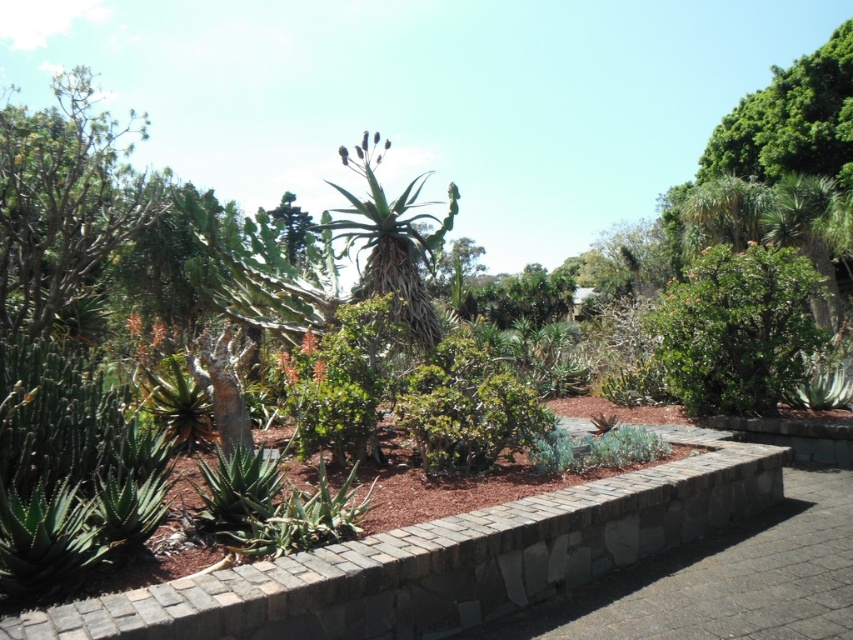
Does point (849, 486) lie in front of point (703, 332)?

Yes, point (849, 486) is closer to viewer.

Based on the photo, can you confirm if gray stone bench at lower center is positioned to the right of green leafy bush at center-right?

In fact, gray stone bench at lower center is to the left of green leafy bush at center-right.

The height and width of the screenshot is (640, 853). Describe the element at coordinates (721, 579) in the screenshot. I see `gray stone bench at lower center` at that location.

Find the location of a particular element. gray stone bench at lower center is located at coordinates (721, 579).

Is point (741, 614) closer to viewer compared to point (88, 170)?

Yes, it is.

Between gray stone bench at lower center and green leafy tree at upper left, which one appears on the right side from the viewer's perspective?

gray stone bench at lower center

Is point (705, 582) farther from camera compared to point (61, 92)?

That is False.

Locate an element on the screen. gray stone bench at lower center is located at coordinates (721, 579).

Who is more distant from viewer, (x=35, y=275) or (x=473, y=396)?

The point (x=35, y=275) is more distant.

Is point (132, 212) positioned after point (506, 404)?

Yes, it is.

The width and height of the screenshot is (853, 640). In order to click on green leafy tree at upper left in this screenshot , I will do `click(65, 198)`.